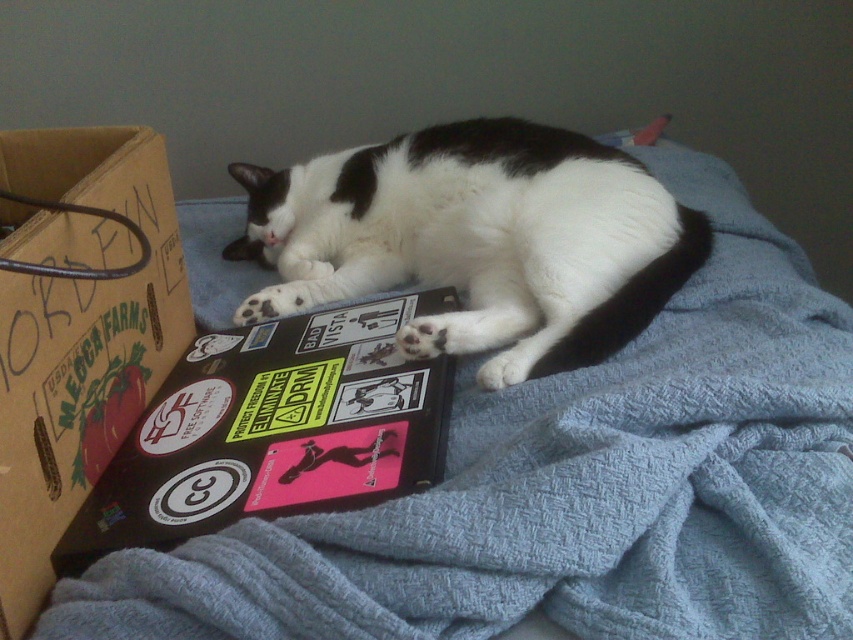
Question: Observing the image, what is the correct spatial positioning of black and white fur cat at center in reference to cardboard box at left?

Choices:
 (A) left
 (B) right

Answer: (B)

Question: Among these points, which one is farthest from the camera?

Choices:
 (A) (1, 445)
 (B) (321, 230)
 (C) (190, 397)

Answer: (B)

Question: Which of the following is the farthest from the observer?

Choices:
 (A) (317, 433)
 (B) (103, 182)
 (C) (654, 204)

Answer: (C)

Question: Which object is the closest to the black and white fur cat at center?

Choices:
 (A) cardboard box at left
 (B) sticker-covered paperback book at center

Answer: (B)

Question: Does black and white fur cat at center have a larger size compared to sticker-covered paperback book at center?

Choices:
 (A) yes
 (B) no

Answer: (A)

Question: Can you confirm if black and white fur cat at center is positioned to the left of sticker-covered paperback book at center?

Choices:
 (A) no
 (B) yes

Answer: (A)